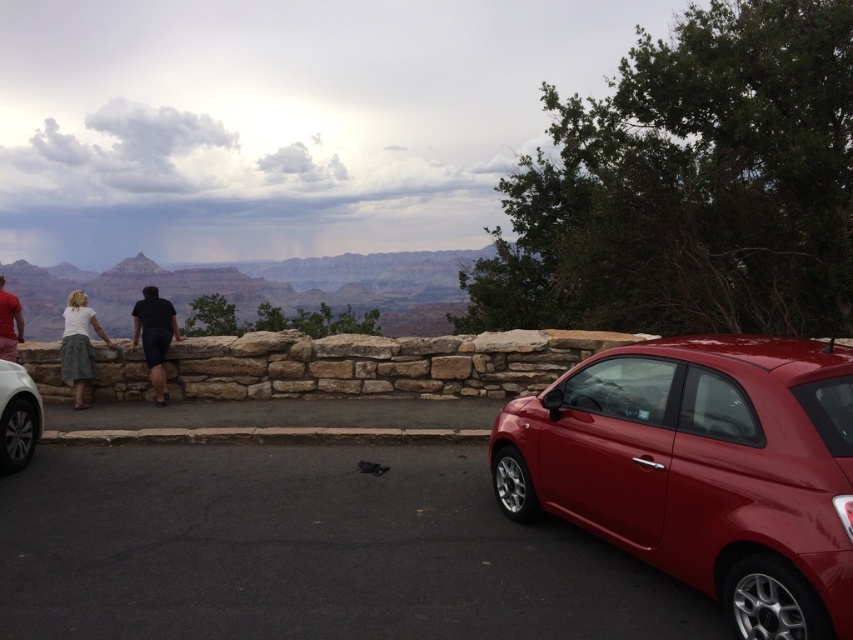
You are standing at the center of the parking area and want to locate the white glossy car at lower left. According to the coordinates, where should you look relative to your position?

The white glossy car at lower left is located at point 0.652 on the x axis and 0.021 on the y axis, which means it is to the right and slightly forward from your central position in the parking area.

You are standing at the overlook and want to take a photo of both point markers in the scene. Which point marker, point [15,444] or point [157,387], will appear larger in your camera view?

Point [15,444] will appear larger in the camera view because it is closer to the camera than point [157,387].

You are standing at the overlook and want to take a photo of both the rugged rock formations in the background and the two people near the stone wall. Which of the two points, point (822,550) or point (65,381), is closer to you and should be prioritized in your composition?

Point (822,550) is closer to the viewer than point (65,381), so it should be prioritized in your composition to ensure both the foreground and background elements are in focus.